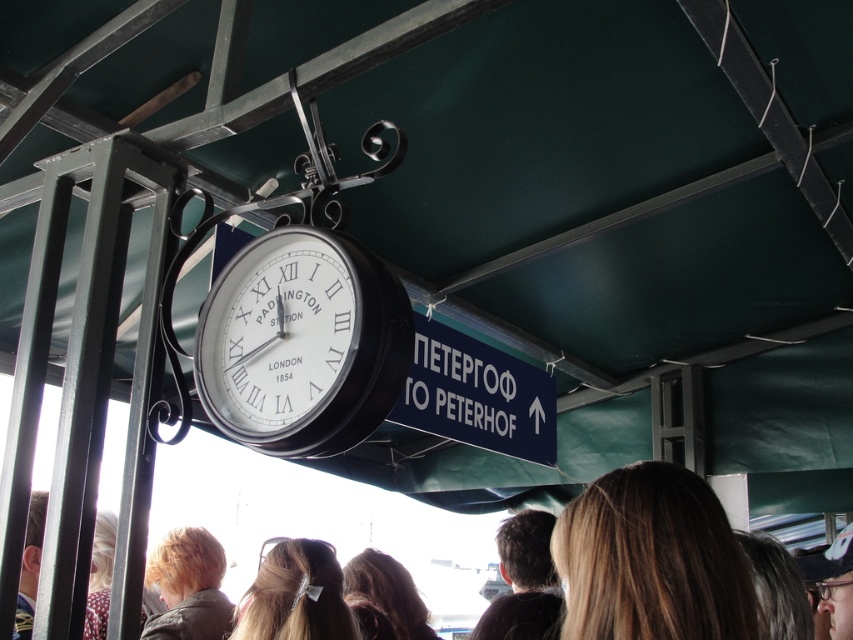
Question: Estimate the real-world distances between objects in this image. Which object is farther from the blonde hair with clip at center?

Choices:
 (A) white matte clock at center
 (B) blonde hair at lower left

Answer: (A)

Question: Which of the following is the closest to the observer?

Choices:
 (A) (277, 436)
 (B) (312, 616)

Answer: (A)

Question: Can you confirm if blonde hair with clip at center is positioned to the right of dark brown hair at center?

Choices:
 (A) no
 (B) yes

Answer: (A)

Question: Observing the image, what is the correct spatial positioning of white matte clock at center in reference to blonde hair at lower left?

Choices:
 (A) below
 (B) above

Answer: (B)

Question: Which object is closer to the camera taking this photo?

Choices:
 (A) dark brown hair at center
 (B) blonde hair with clip at center
 (C) blonde hair at lower left
 (D) white matte clock at center

Answer: (D)

Question: Is blonde hair with clip at center positioned at the back of dark brown hair at center?

Choices:
 (A) no
 (B) yes

Answer: (A)